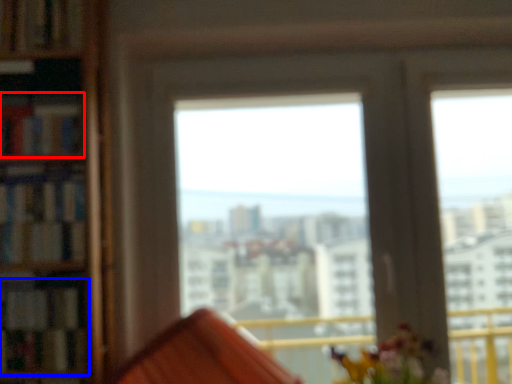
Question: Which of the following is the closest to the observer, book (highlighted by a red box) or book (highlighted by a blue box)?

Choices:
 (A) book
 (B) book

Answer: (B)